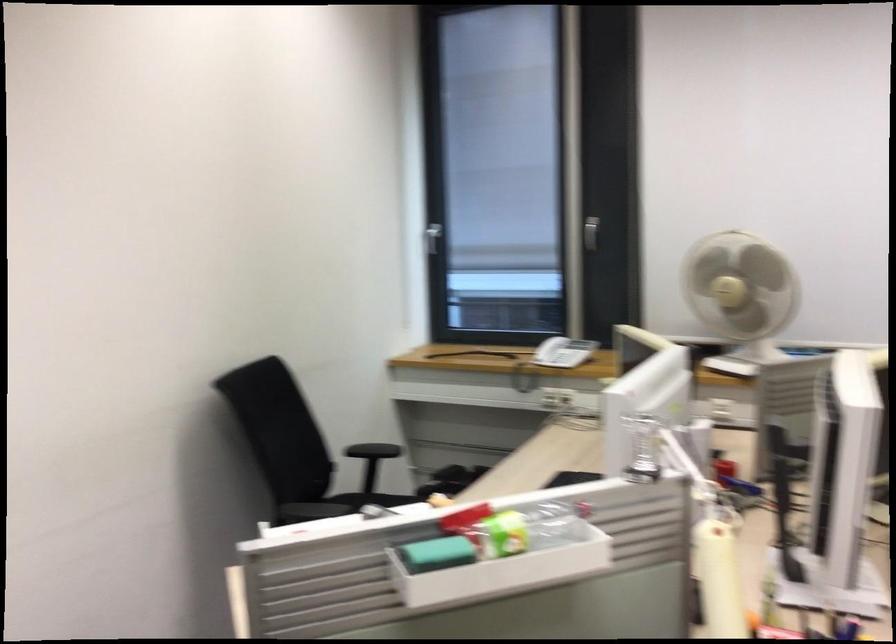
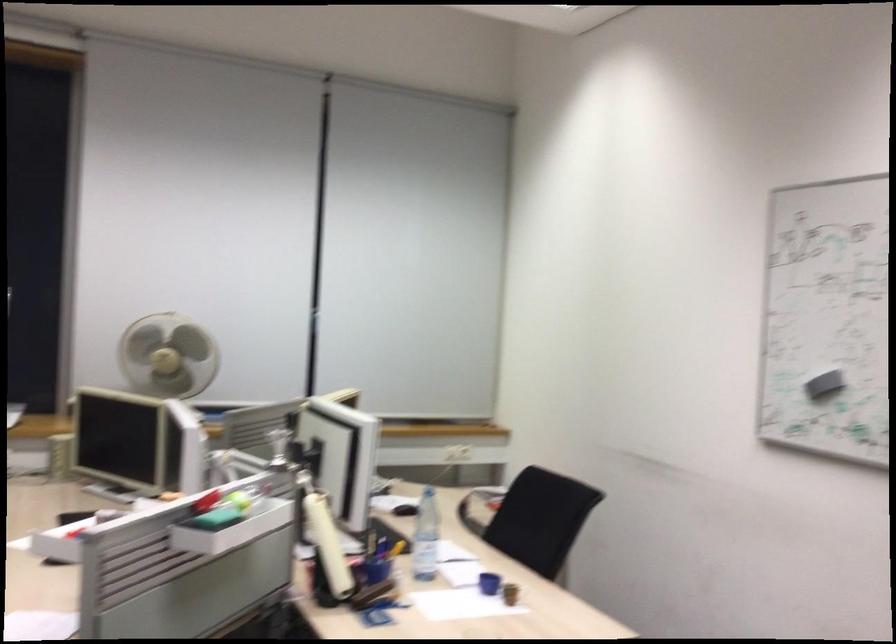
Where in the second image is the point corresponding to point 752,267 from the first image?

(168, 355)